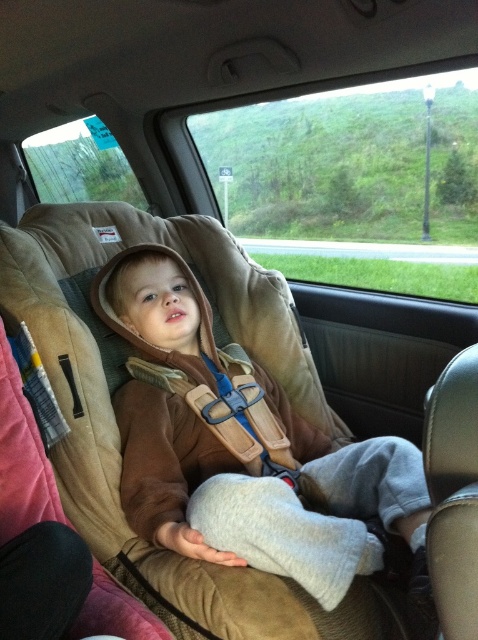
Question: Can you confirm if brown suede hoodie at center is thinner than suede-like beige car seat at left?

Choices:
 (A) no
 (B) yes

Answer: (A)

Question: Is brown suede hoodie at center bigger than suede-like beige car seat at left?

Choices:
 (A) yes
 (B) no

Answer: (A)

Question: Which of the following is the farthest from the observer?

Choices:
 (A) (15, 570)
 (B) (151, 444)

Answer: (B)

Question: Is brown suede hoodie at center above suede-like beige car seat at left?

Choices:
 (A) yes
 (B) no

Answer: (A)